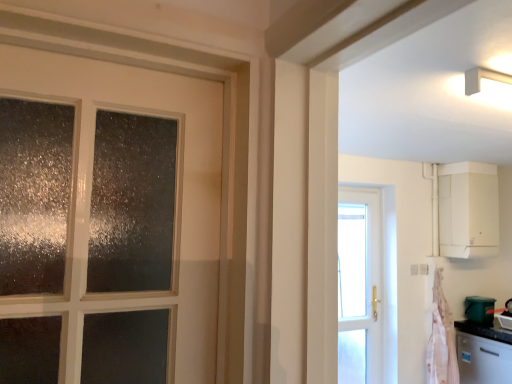
Question: Is pink fabric at right positioned far away from green plastic bucket at lower right?

Choices:
 (A) yes
 (B) no

Answer: (B)

Question: Could green plastic bucket at lower right be considered to be inside pink fabric at right?

Choices:
 (A) no
 (B) yes

Answer: (A)

Question: Is pink fabric at right shorter than green plastic bucket at lower right?

Choices:
 (A) yes
 (B) no

Answer: (B)

Question: Does pink fabric at right lie behind green plastic bucket at lower right?

Choices:
 (A) no
 (B) yes

Answer: (A)

Question: Does pink fabric at right touch green plastic bucket at lower right?

Choices:
 (A) no
 (B) yes

Answer: (A)

Question: In terms of height, does green plastic bucket at lower right look taller or shorter compared to satin silver dishwasher at lower right?

Choices:
 (A) tall
 (B) short

Answer: (B)

Question: Is green plastic bucket at lower right wider or thinner than satin silver dishwasher at lower right?

Choices:
 (A) thin
 (B) wide

Answer: (A)

Question: Does point click(477, 317) appear closer or farther from the camera than point click(473, 362)?

Choices:
 (A) farther
 (B) closer

Answer: (A)

Question: Considering their positions, is green plastic bucket at lower right located in front of or behind satin silver dishwasher at lower right?

Choices:
 (A) behind
 (B) front

Answer: (A)

Question: Based on their positions, is pink fabric at right located to the left or right of satin silver dishwasher at lower right?

Choices:
 (A) left
 (B) right

Answer: (A)

Question: Looking at the image, does pink fabric at right seem bigger or smaller compared to satin silver dishwasher at lower right?

Choices:
 (A) small
 (B) big

Answer: (A)

Question: Is pink fabric at right taller or shorter than satin silver dishwasher at lower right?

Choices:
 (A) short
 (B) tall

Answer: (B)

Question: From a real-world perspective, relative to satin silver dishwasher at lower right, is pink fabric at right vertically above or below?

Choices:
 (A) below
 (B) above

Answer: (B)

Question: From the image's perspective, is satin silver dishwasher at lower right above or below green plastic bucket at lower right?

Choices:
 (A) below
 (B) above

Answer: (A)

Question: From a real-world perspective, is satin silver dishwasher at lower right positioned above or below green plastic bucket at lower right?

Choices:
 (A) below
 (B) above

Answer: (A)